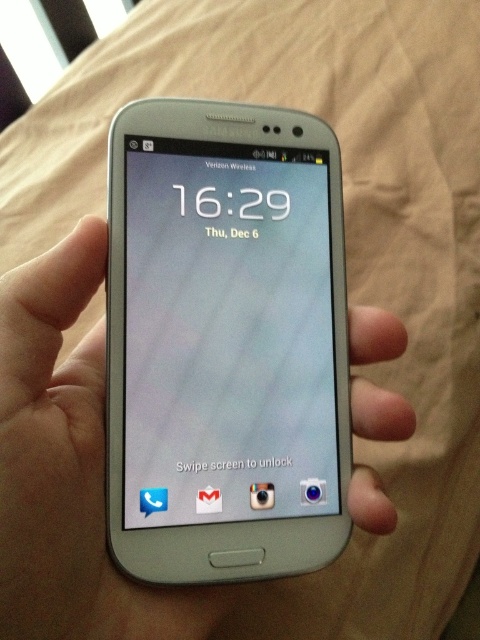
You are trying to unlock your phone but notice two phone models displayed on the screen. Which one is placed higher up between the satin silver phone at center and the silver metallic phone at center?

The satin silver phone at center is positioned over the silver metallic phone at center, meaning it is placed higher up.

You are trying to decide which phone to take with you on a trip. You have two options in front of you, the satin silver phone at center and the silver metallic phone at center. Based on their physical characteristics, which one is more likely to fit comfortably in your pocket?

The satin silver phone at center is thinner than the silver metallic phone at center, so it is more likely to fit comfortably in your pocket.